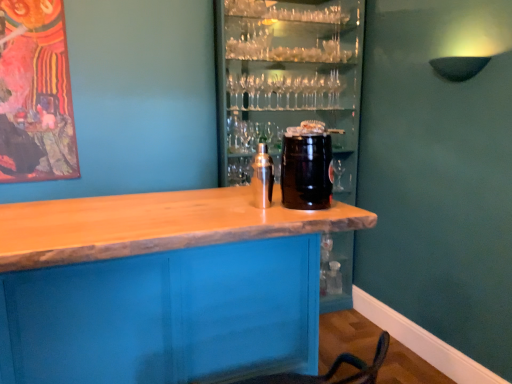
Image resolution: width=512 pixels, height=384 pixels. What do you see at coordinates (161, 287) in the screenshot?
I see `wooden table at center` at bounding box center [161, 287].

The image size is (512, 384). Describe the element at coordinates (306, 171) in the screenshot. I see `black matte keg at center, acting as the 2th beverage starting from the left` at that location.

At what (x,y) coordinates should I click in order to perform the action: click on satin silver shaker at center, which ranks as the 2th beverage in right-to-left order. Please return your answer as a coordinate pair (x, y). This screenshot has width=512, height=384. Looking at the image, I should click on (262, 177).

Which is in front, satin silver shaker at center, the first beverage in the left-to-right sequence, or black matte keg at center, acting as the 2th beverage starting from the left?

Positioned in front is black matte keg at center, acting as the 2th beverage starting from the left.

Is satin silver shaker at center, which ranks as the 2th beverage in right-to-left order, completely or partially outside of black matte keg at center, acting as the 2th beverage starting from the left?

Yes.

Is satin silver shaker at center, which ranks as the 2th beverage in right-to-left order, bigger or smaller than black matte keg at center, the first beverage from the right?

satin silver shaker at center, which ranks as the 2th beverage in right-to-left order, is smaller than black matte keg at center, the first beverage from the right.

Could you measure the distance between satin silver shaker at center, the first beverage in the left-to-right sequence, and black matte keg at center, acting as the 2th beverage starting from the left?

satin silver shaker at center, the first beverage in the left-to-right sequence, is 13.48 centimeters away from black matte keg at center, acting as the 2th beverage starting from the left.

Is there a large distance between wooden at center and satin silver shaker at center, which ranks as the 2th beverage in right-to-left order?

That's right, there is a large distance between wooden at center and satin silver shaker at center, which ranks as the 2th beverage in right-to-left order.

From a real-world perspective, is wooden at center above or below satin silver shaker at center, the first beverage in the left-to-right sequence?

wooden at center is below satin silver shaker at center, the first beverage in the left-to-right sequence.

Is wooden at center taller than satin silver shaker at center, the first beverage in the left-to-right sequence?

Yes.

Is wooden at center smaller than satin silver shaker at center, the first beverage in the left-to-right sequence?

No, wooden at center is not smaller than satin silver shaker at center, the first beverage in the left-to-right sequence.

Considering the sizes of objects black matte keg at center, acting as the 2th beverage starting from the left, and satin silver shaker at center, the first beverage in the left-to-right sequence, in the image provided, who is shorter, black matte keg at center, acting as the 2th beverage starting from the left, or satin silver shaker at center, the first beverage in the left-to-right sequence,?

Standing shorter between the two is satin silver shaker at center, the first beverage in the left-to-right sequence.

Are black matte keg at center, the first beverage from the right, and satin silver shaker at center, the first beverage in the left-to-right sequence, located far from each other?

That's not correct — black matte keg at center, the first beverage from the right, is a little close to satin silver shaker at center, the first beverage in the left-to-right sequence.

From a real-world perspective, is black matte keg at center, acting as the 2th beverage starting from the left, beneath satin silver shaker at center, the first beverage in the left-to-right sequence?

No.

At what (x,y) coordinates should I click in order to perform the action: click on beverage located below the black matte keg at center, acting as the 2th beverage starting from the left (from the image's perspective). Please return your answer as a coordinate pair (x, y). The width and height of the screenshot is (512, 384). Looking at the image, I should click on 262,177.

From the image's perspective, is satin silver shaker at center, which ranks as the 2th beverage in right-to-left order, located above wooden at center?

No, from the image's perspective, satin silver shaker at center, which ranks as the 2th beverage in right-to-left order, is not above wooden at center.

Considering the points (254, 191) and (298, 55), which point is behind, point (254, 191) or point (298, 55)?

The point (298, 55) is farther.

Can you confirm if satin silver shaker at center, which ranks as the 2th beverage in right-to-left order, is positioned to the left of wooden at center?

Indeed, satin silver shaker at center, which ranks as the 2th beverage in right-to-left order, is positioned on the left side of wooden at center.

Can you confirm if satin silver shaker at center, which ranks as the 2th beverage in right-to-left order, is thinner than wooden at center?

Yes, satin silver shaker at center, which ranks as the 2th beverage in right-to-left order, is thinner than wooden at center.

Is wooden at center positioned with its back to wooden table at center?

No, wooden at center is not facing the opposite direction of wooden table at center.

How different are the orientations of wooden at center and wooden table at center in degrees?

179 degrees.

Is wooden at center taller or shorter than wooden table at center?

Clearly, wooden at center is taller compared to wooden table at center.

Considering the sizes of objects wooden at center and wooden table at center in the image provided, who is thinner, wooden at center or wooden table at center?

With smaller width is wooden at center.

Does wooden table at center turn towards satin silver shaker at center, the first beverage in the left-to-right sequence?

No.

Would you say wooden table at center is outside satin silver shaker at center, which ranks as the 2th beverage in right-to-left order?

wooden table at center lies outside satin silver shaker at center, which ranks as the 2th beverage in right-to-left order,'s area.

In order to click on table below the satin silver shaker at center, the first beverage in the left-to-right sequence (from a real-world perspective) in this screenshot , I will do pos(161,287).

Does wooden table at center have a lesser width compared to satin silver shaker at center, which ranks as the 2th beverage in right-to-left order?

In fact, wooden table at center might be wider than satin silver shaker at center, which ranks as the 2th beverage in right-to-left order.

How different are the orientations of satin silver shaker at center, which ranks as the 2th beverage in right-to-left order, and wooden table at center in degrees?

The angle between the facing direction of satin silver shaker at center, which ranks as the 2th beverage in right-to-left order, and the facing direction of wooden table at center is 179 degrees.

Is satin silver shaker at center, the first beverage in the left-to-right sequence, oriented towards wooden table at center?

No, satin silver shaker at center, the first beverage in the left-to-right sequence, does not turn towards wooden table at center.

Based on the photo, who is bigger, satin silver shaker at center, which ranks as the 2th beverage in right-to-left order, or wooden table at center?

With larger size is wooden table at center.

Where is `beverage lying on the right of satin silver shaker at center, the first beverage in the left-to-right sequence`? The image size is (512, 384). beverage lying on the right of satin silver shaker at center, the first beverage in the left-to-right sequence is located at coordinates tap(306, 171).

Find the location of a particular element. The height and width of the screenshot is (384, 512). beverage that is the 2nd object located below the wooden at center (from the image's perspective) is located at coordinates (262, 177).

Considering their positions, is wooden at center positioned further to black matte keg at center, acting as the 2th beverage starting from the left, than satin silver shaker at center, which ranks as the 2th beverage in right-to-left order?

wooden at center lies further to black matte keg at center, acting as the 2th beverage starting from the left, than the other object.

Based on their spatial positions, is satin silver shaker at center, which ranks as the 2th beverage in right-to-left order, or wooden at center further from black matte keg at center, the first beverage from the right?

Among the two, wooden at center is located further to black matte keg at center, the first beverage from the right.

Estimate the real-world distances between objects in this image. Which object is closer to satin silver shaker at center, the first beverage in the left-to-right sequence, wooden at center or black matte keg at center, the first beverage from the right?

Among the two, black matte keg at center, the first beverage from the right, is located nearer to satin silver shaker at center, the first beverage in the left-to-right sequence.

Based on their spatial positions, is wooden table at center or wooden at center closer to satin silver shaker at center, the first beverage in the left-to-right sequence?

wooden table at center.

Looking at the image, which one is located further to satin silver shaker at center, which ranks as the 2th beverage in right-to-left order, wooden table at center or black matte keg at center, the first beverage from the right?

Based on the image, wooden table at center appears to be further to satin silver shaker at center, which ranks as the 2th beverage in right-to-left order.

Estimate the real-world distances between objects in this image. Which object is further from wooden at center, wooden table at center or black matte keg at center, the first beverage from the right?

Answer: black matte keg at center, the first beverage from the right, is further to wooden at center.

Considering their positions, is black matte keg at center, acting as the 2th beverage starting from the left, positioned closer to wooden table at center than satin silver shaker at center, the first beverage in the left-to-right sequence?

satin silver shaker at center, the first beverage in the left-to-right sequence.

From the image, which object appears to be farther from satin silver shaker at center, the first beverage in the left-to-right sequence, black matte keg at center, acting as the 2th beverage starting from the left, or wooden at center?

wooden at center lies further to satin silver shaker at center, the first beverage in the left-to-right sequence, than the other object.

Locate an element on the screen. The width and height of the screenshot is (512, 384). beverage that lies between black matte keg at center, the first beverage from the right, and wooden table at center from top to bottom is located at coordinates (262, 177).

Locate an element on the screen. beverage positioned between black matte keg at center, the first beverage from the right, and wooden at center from near to far is located at coordinates tap(262, 177).